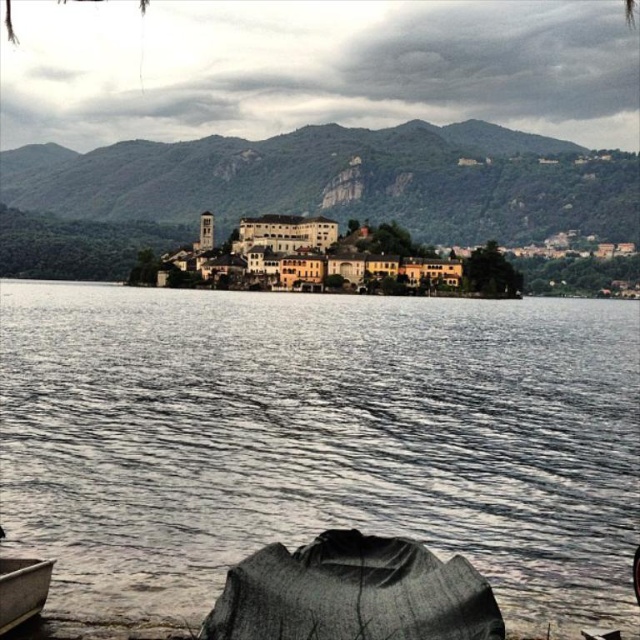
Question: Among these objects, which one is farthest from the camera?

Choices:
 (A) wooden canoe at lower left
 (B) gray water at center

Answer: (B)

Question: Among these points, which one is nearest to the camera?

Choices:
 (A) (33, 598)
 (B) (113, 563)

Answer: (A)

Question: Does gray water at center appear over wooden canoe at lower left?

Choices:
 (A) no
 (B) yes

Answer: (B)

Question: Which object is closer to the camera taking this photo?

Choices:
 (A) gray water at center
 (B) wooden canoe at lower left

Answer: (B)

Question: Does gray water at center appear over wooden canoe at lower left?

Choices:
 (A) no
 (B) yes

Answer: (B)

Question: Does gray water at center appear over wooden canoe at lower left?

Choices:
 (A) yes
 (B) no

Answer: (A)